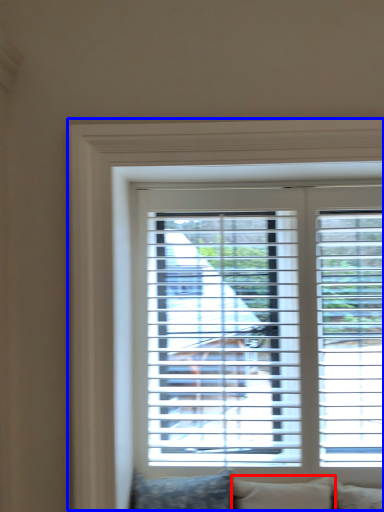
Question: Which object appears closest to the camera in this image, pillow (highlighted by a red box) or window (highlighted by a blue box)?

Choices:
 (A) pillow
 (B) window

Answer: (A)